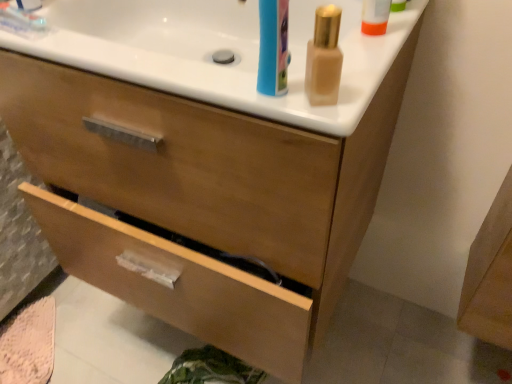
This screenshot has height=384, width=512. I want to click on white glossy counter top at upper center, so click(x=216, y=50).

This screenshot has height=384, width=512. Describe the element at coordinates (178, 285) in the screenshot. I see `wooden drawer at lower center, the first drawer when ordered from bottom to top` at that location.

I want to click on wooden drawer at center, the second drawer from the bottom, so click(x=177, y=162).

Image resolution: width=512 pixels, height=384 pixels. I want to click on mouthwash that is in front of the wooden drawer at lower center, which ranks as the 2th drawer in top-to-bottom order, so click(x=324, y=58).

From a real-world perspective, who is located higher, satin gold bottle at upper right or wooden drawer at lower center, which ranks as the 2th drawer in top-to-bottom order?

From a 3D spatial view, satin gold bottle at upper right is above.

In the scene shown: Does satin gold bottle at upper right have a lesser height compared to wooden drawer at lower center, which ranks as the 2th drawer in top-to-bottom order?

Incorrect, the height of satin gold bottle at upper right does not fall short of that of wooden drawer at lower center, which ranks as the 2th drawer in top-to-bottom order.

Considering their positions, is satin gold bottle at upper right located in front of or behind wooden drawer at lower center, the first drawer when ordered from bottom to top?

Clearly, satin gold bottle at upper right is in front of wooden drawer at lower center, the first drawer when ordered from bottom to top.

The height and width of the screenshot is (384, 512). I want to click on drawer that is under the wooden drawer at center, the 1th drawer in the top-to-bottom sequence (from a real-world perspective), so click(178, 285).

Based on their sizes in the image, would you say wooden drawer at center, the second drawer from the bottom, is bigger or smaller than wooden drawer at lower center, which ranks as the 2th drawer in top-to-bottom order?

In the image, wooden drawer at center, the second drawer from the bottom, appears to be larger than wooden drawer at lower center, which ranks as the 2th drawer in top-to-bottom order.

Looking at their sizes, would you say satin gold bottle at upper right is wider or thinner than wooden drawer at center, the second drawer from the bottom?

In the image, satin gold bottle at upper right appears to be more narrow than wooden drawer at center, the second drawer from the bottom.

From a real-world perspective, who is located higher, satin gold bottle at upper right or wooden drawer at center, the second drawer from the bottom?

From a 3D spatial view, satin gold bottle at upper right is above.

Considering the relative positions of satin gold bottle at upper right and wooden drawer at center, the second drawer from the bottom, in the image provided, is satin gold bottle at upper right in front of wooden drawer at center, the second drawer from the bottom,?

Yes, it is.

Where is `mouthwash that is above the wooden drawer at center, the second drawer from the bottom (from a real-world perspective)`? The height and width of the screenshot is (384, 512). mouthwash that is above the wooden drawer at center, the second drawer from the bottom (from a real-world perspective) is located at coordinates (324, 58).

From the image's perspective, is wooden drawer at lower center, which ranks as the 2th drawer in top-to-bottom order, under wooden drawer at center, the 1th drawer in the top-to-bottom sequence?

Yes, from the image's perspective, wooden drawer at lower center, which ranks as the 2th drawer in top-to-bottom order, is below wooden drawer at center, the 1th drawer in the top-to-bottom sequence.

Is point (274, 298) positioned behind point (291, 180)?

Yes, it is behind point (291, 180).

Which object is positioned more to the left, white glossy counter top at upper center or wooden drawer at center, the second drawer from the bottom?

wooden drawer at center, the second drawer from the bottom, is more to the left.

Based on the photo, who is more distant, white glossy counter top at upper center or wooden drawer at center, the 1th drawer in the top-to-bottom sequence?

white glossy counter top at upper center.

From the image's perspective, which one is positioned higher, white glossy counter top at upper center or wooden drawer at center, the 1th drawer in the top-to-bottom sequence?

white glossy counter top at upper center appears higher in the image.

Is wooden drawer at center, the second drawer from the bottom, positioned far away from white glossy counter top at upper center?

They are positioned close to each other.

Considering the positions of objects wooden drawer at center, the second drawer from the bottom, and white glossy counter top at upper center in the image provided, who is more to the right, wooden drawer at center, the second drawer from the bottom, or white glossy counter top at upper center?

Positioned to the right is white glossy counter top at upper center.

Measure the distance from wooden drawer at center, the second drawer from the bottom, to white glossy counter top at upper center.

wooden drawer at center, the second drawer from the bottom, and white glossy counter top at upper center are 5.82 inches apart.

From the image's perspective, between wooden drawer at center, the second drawer from the bottom, and white glossy counter top at upper center, which one is located above?

white glossy counter top at upper center, from the image's perspective.

Which of these two, white glossy counter top at upper center or wooden drawer at lower center, which ranks as the 2th drawer in top-to-bottom order, stands taller?

white glossy counter top at upper center is taller.

Based on the photo, considering the relative sizes of white glossy counter top at upper center and wooden drawer at lower center, the first drawer when ordered from bottom to top, in the image provided, is white glossy counter top at upper center bigger than wooden drawer at lower center, the first drawer when ordered from bottom to top,?

Correct, white glossy counter top at upper center is larger in size than wooden drawer at lower center, the first drawer when ordered from bottom to top.

Would you say wooden drawer at lower center, the first drawer when ordered from bottom to top, is part of white glossy counter top at upper center's contents?

Definitely not — wooden drawer at lower center, the first drawer when ordered from bottom to top, is not inside white glossy counter top at upper center.

Locate an element on the screen. Image resolution: width=512 pixels, height=384 pixels. mouthwash in front of the wooden drawer at lower center, the first drawer when ordered from bottom to top is located at coordinates (324, 58).

Identify the location of drawer to the right of wooden drawer at center, the 1th drawer in the top-to-bottom sequence. This screenshot has height=384, width=512. (178, 285).

From the image, which object appears to be farther from wooden drawer at lower center, which ranks as the 2th drawer in top-to-bottom order, white glossy counter top at upper center or satin gold bottle at upper right?

satin gold bottle at upper right.

From the image, which object appears to be farther from wooden drawer at lower center, which ranks as the 2th drawer in top-to-bottom order, wooden drawer at center, the 1th drawer in the top-to-bottom sequence, or white glossy counter top at upper center?

Based on the image, white glossy counter top at upper center appears to be further to wooden drawer at lower center, which ranks as the 2th drawer in top-to-bottom order.

Estimate the real-world distances between objects in this image. Which object is closer to white glossy counter top at upper center, satin gold bottle at upper right or wooden drawer at lower center, the first drawer when ordered from bottom to top?

satin gold bottle at upper right.

Estimate the real-world distances between objects in this image. Which object is further from wooden drawer at center, the 1th drawer in the top-to-bottom sequence, white glossy counter top at upper center or satin gold bottle at upper right?

satin gold bottle at upper right is positioned further to the anchor wooden drawer at center, the 1th drawer in the top-to-bottom sequence.

In the scene shown: Looking at the image, which one is located further to satin gold bottle at upper right, wooden drawer at lower center, which ranks as the 2th drawer in top-to-bottom order, or wooden drawer at center, the 1th drawer in the top-to-bottom sequence?

wooden drawer at lower center, which ranks as the 2th drawer in top-to-bottom order, is further to satin gold bottle at upper right.

Considering their positions, is wooden drawer at lower center, which ranks as the 2th drawer in top-to-bottom order, positioned closer to white glossy counter top at upper center than wooden drawer at center, the second drawer from the bottom?

wooden drawer at center, the second drawer from the bottom, is closer to white glossy counter top at upper center.

Which object lies further to the anchor point white glossy counter top at upper center, satin gold bottle at upper right or wooden drawer at center, the second drawer from the bottom?

satin gold bottle at upper right is further to white glossy counter top at upper center.

Looking at the image, which one is located further to satin gold bottle at upper right, wooden drawer at center, the second drawer from the bottom, or white glossy counter top at upper center?

The object further to satin gold bottle at upper right is wooden drawer at center, the second drawer from the bottom.

Where is `mouthwash between white glossy counter top at upper center and wooden drawer at lower center, the first drawer when ordered from bottom to top, vertically`? mouthwash between white glossy counter top at upper center and wooden drawer at lower center, the first drawer when ordered from bottom to top, vertically is located at coordinates (324, 58).

Locate an element on the screen. The width and height of the screenshot is (512, 384). drawer that lies between white glossy counter top at upper center and wooden drawer at lower center, which ranks as the 2th drawer in top-to-bottom order, from top to bottom is located at coordinates (177, 162).

At what (x,y) coordinates should I click in order to perform the action: click on drawer between satin gold bottle at upper right and wooden drawer at lower center, the first drawer when ordered from bottom to top, in the up-down direction. Please return your answer as a coordinate pair (x, y). Looking at the image, I should click on (177, 162).

The height and width of the screenshot is (384, 512). Identify the location of mouthwash between white glossy counter top at upper center and wooden drawer at center, the second drawer from the bottom, in the vertical direction. (324, 58).